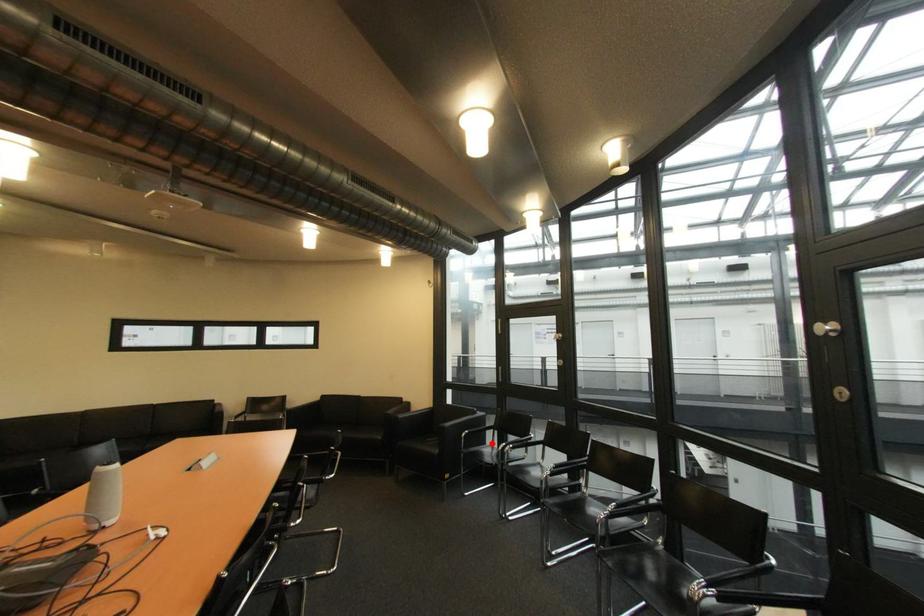
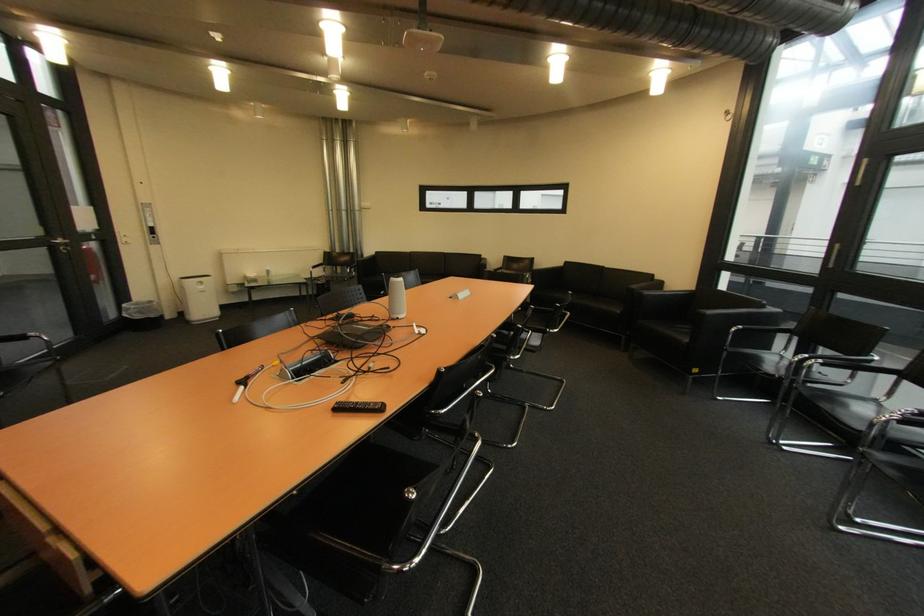
Locate, in the second image, the point that corresponds to the highlighted location in the first image.

(775, 349)